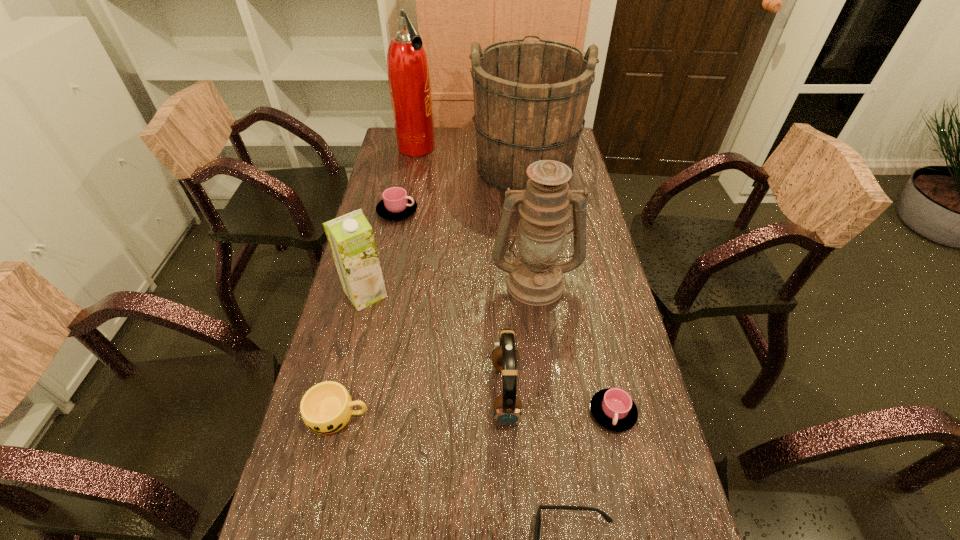
You are a GUI agent. You are given a task and a screenshot of the screen. Output one action in this format:
    pyautogui.click(x=<x>, y=<y>)
    Task: Click on the fire extinguisher
    Image resolution: width=960 pixels, height=540 pixels.
    Given the screenshot: What is the action you would take?
    pyautogui.click(x=408, y=73)

Find the location of `bucket`. bucket is located at coordinates (530, 97).

Where is `oil lamp`? oil lamp is located at coordinates (535, 277).

This screenshot has width=960, height=540. Find the location of `green soya milk`. green soya milk is located at coordinates (351, 239).

This screenshot has height=540, width=960. Find the location of `the fourth tallest object`. the fourth tallest object is located at coordinates (351, 239).

Where is `the fifth shortest object`? This screenshot has width=960, height=540. the fifth shortest object is located at coordinates (507, 407).

Identify the location of headset. (507, 407).

At what (x,y) coordinates should I click in order to perform the action: click on the farther pink cup. Please return your answer as a coordinate pair (x, y). This screenshot has height=540, width=960. Looking at the image, I should click on (396, 205).

Locate an element on the screen. The height and width of the screenshot is (540, 960). the left pink cup is located at coordinates (396, 205).

At what (x,y) coordinates should I click in order to perform the action: click on beige cup. Please return your answer as a coordinate pair (x, y). The image size is (960, 540). Looking at the image, I should click on (326, 408).